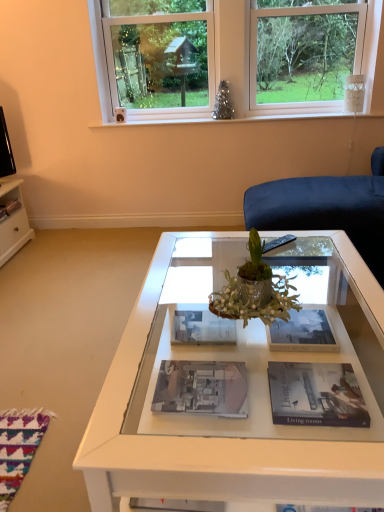
Question: Considering the relative sizes of white plastic window at upper center and matte paper magazine at center, which ranks as the 1th magazine in right-to-left order, in the image provided, is white plastic window at upper center taller than matte paper magazine at center, which ranks as the 1th magazine in right-to-left order,?

Choices:
 (A) yes
 (B) no

Answer: (A)

Question: Does white plastic window at upper center turn towards matte paper magazine at center, placed as the third magazine when sorted from front to back?

Choices:
 (A) no
 (B) yes

Answer: (A)

Question: Would you consider white plastic window at upper center to be distant from matte paper magazine at center, placed as the third magazine when sorted from front to back?

Choices:
 (A) no
 (B) yes

Answer: (B)

Question: Considering the relative sizes of white plastic window at upper center and matte paper magazine at center, which ranks as the 1th magazine in right-to-left order, in the image provided, is white plastic window at upper center thinner than matte paper magazine at center, which ranks as the 1th magazine in right-to-left order,?

Choices:
 (A) yes
 (B) no

Answer: (A)

Question: Does white plastic window at upper center have a larger size compared to matte paper magazine at center, the 2th magazine positioned from the top?

Choices:
 (A) no
 (B) yes

Answer: (B)

Question: Is matte paper magazine at center, which is the 1th magazine in bottom-to-top order, inside the boundaries of white glossy coffee table at center, or outside?

Choices:
 (A) outside
 (B) inside

Answer: (A)

Question: Is matte paper magazine at center, which is the 1th magazine in bottom-to-top order, taller or shorter than white glossy coffee table at center?

Choices:
 (A) short
 (B) tall

Answer: (A)

Question: Considering their positions, is matte paper magazine at center, which ranks as the first magazine in front-to-back order, located in front of or behind white glossy coffee table at center?

Choices:
 (A) front
 (B) behind

Answer: (B)

Question: Looking at the image, does matte paper magazine at center, which ranks as the first magazine in front-to-back order, seem bigger or smaller compared to white glossy coffee table at center?

Choices:
 (A) small
 (B) big

Answer: (A)

Question: Considering the positions of point (228, 47) and point (276, 331), is point (228, 47) closer or farther from the camera than point (276, 331)?

Choices:
 (A) farther
 (B) closer

Answer: (A)

Question: Do you think white plastic window at upper center is within matte paper magazine at center, acting as the 4th magazine starting from the bottom, or outside of it?

Choices:
 (A) inside
 (B) outside

Answer: (B)

Question: From a real-world perspective, is white plastic window at upper center above or below matte paper magazine at center, acting as the 4th magazine starting from the bottom?

Choices:
 (A) below
 (B) above

Answer: (B)

Question: From the image's perspective, is white plastic window at upper center positioned above or below matte paper magazine at center, the third magazine when ordered from back to front?

Choices:
 (A) below
 (B) above

Answer: (B)

Question: Visually, is white glossy magazine at center, the 4th magazine when ordered from front to back, positioned to the left or to the right of green metallic vase at center?

Choices:
 (A) left
 (B) right

Answer: (A)

Question: Considering the positions of white glossy magazine at center, marked as the 3th magazine in a right-to-left arrangement, and green metallic vase at center in the image, is white glossy magazine at center, marked as the 3th magazine in a right-to-left arrangement, taller or shorter than green metallic vase at center?

Choices:
 (A) short
 (B) tall

Answer: (A)